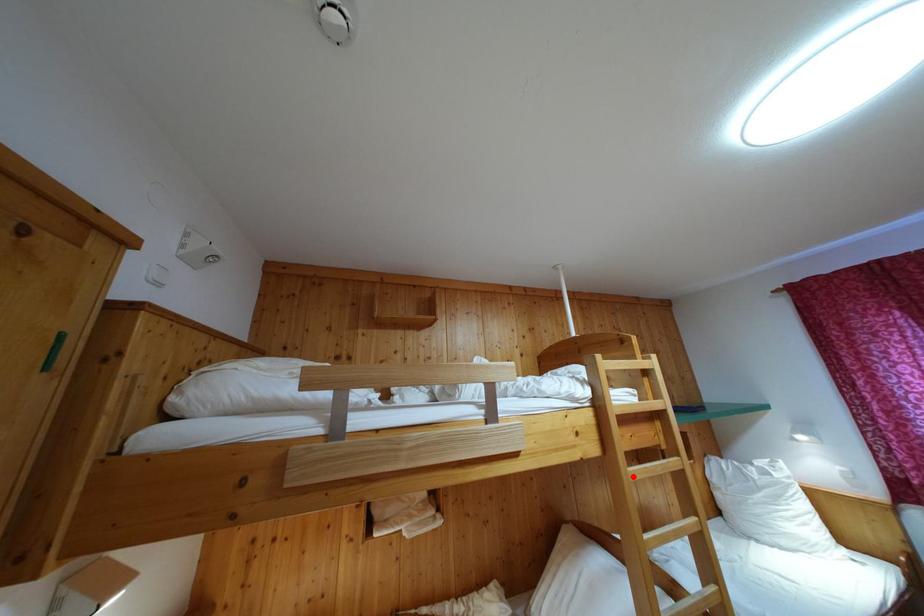
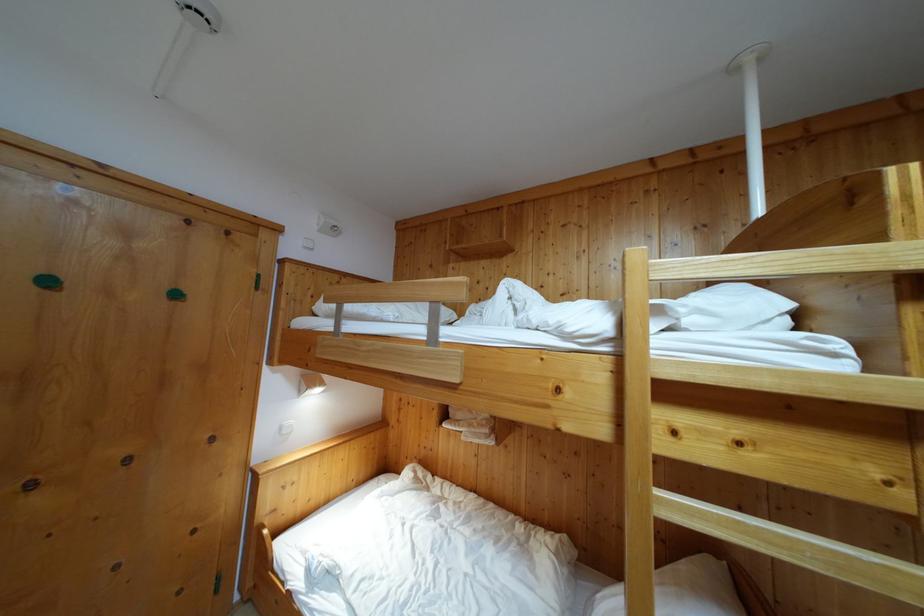
Where in the second image is the point corresponding to the highlighted location from the first image?

(663, 500)